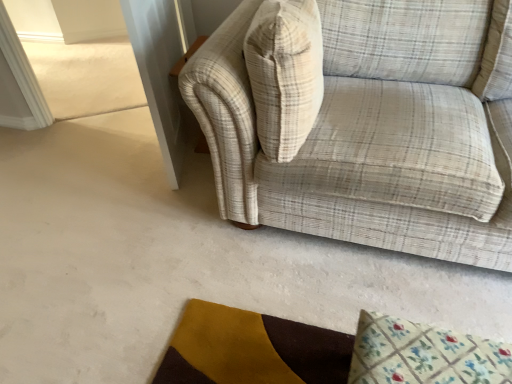
The height and width of the screenshot is (384, 512). I want to click on vacant space situated on the left part of plaid fabric couch at upper right, so click(x=131, y=240).